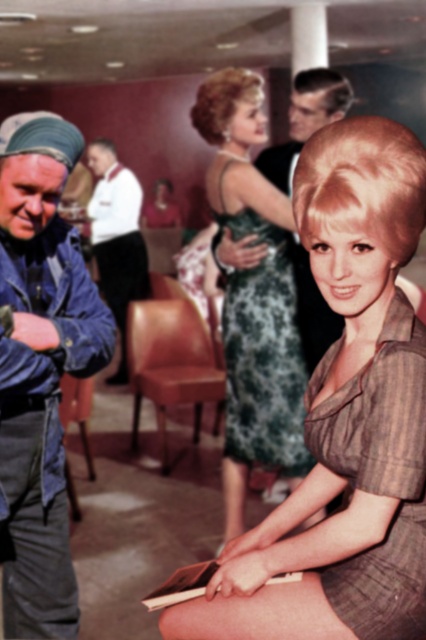
Question: Does leather at center appear over white satin shirt at upper center?

Choices:
 (A) yes
 (B) no

Answer: (B)

Question: Can you confirm if leather at center is thinner than brown leather chair at lower left?

Choices:
 (A) yes
 (B) no

Answer: (B)

Question: Among these points, which one is nearest to the camera?

Choices:
 (A) (66, 426)
 (B) (316, 100)
 (C) (147, 305)

Answer: (B)

Question: Which object is closer to the camera taking this photo?

Choices:
 (A) striped fabric dress at lower right
 (B) shiny brown dress at center
 (C) green lace dress at center
 (D) leather at center

Answer: (A)

Question: In this image, where is blue denim jacket at left located relative to smooth black suit at center?

Choices:
 (A) above
 (B) below

Answer: (B)

Question: Which object appears farthest from the camera in this image?

Choices:
 (A) leather at center
 (B) striped fabric dress at lower right

Answer: (A)